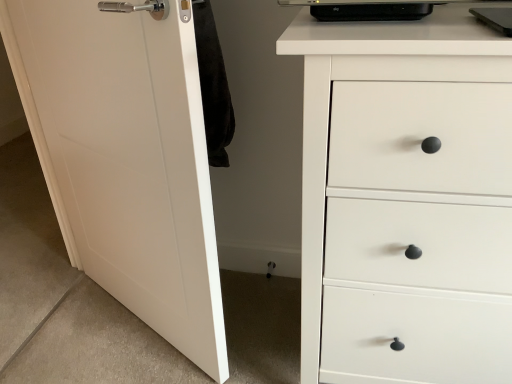
What do you see at coordinates (405, 199) in the screenshot? The width and height of the screenshot is (512, 384). I see `white matte chest of drawers at right` at bounding box center [405, 199].

Locate an element on the screen. The image size is (512, 384). white matte chest of drawers at right is located at coordinates (405, 199).

What do you see at coordinates (126, 157) in the screenshot? The width and height of the screenshot is (512, 384). I see `white matte door at left` at bounding box center [126, 157].

At what (x,y) coordinates should I click in order to perform the action: click on white matte door at left. Please return your answer as a coordinate pair (x, y). This screenshot has height=384, width=512. Looking at the image, I should click on (126, 157).

The height and width of the screenshot is (384, 512). Find the location of `white matte chest of drawers at right`. white matte chest of drawers at right is located at coordinates (405, 199).

Considering the positions of objects white matte chest of drawers at right and white matte door at left in the image provided, who is more to the right, white matte chest of drawers at right or white matte door at left?

Positioned to the right is white matte chest of drawers at right.

Between white matte chest of drawers at right and white matte door at left, which one is positioned behind?

Positioned behind is white matte door at left.

Considering the positions of point (440, 254) and point (185, 43), is point (440, 254) closer or farther from the camera than point (185, 43)?

Clearly, point (440, 254) is more distant from the camera than point (185, 43).

From the image's perspective, does white matte chest of drawers at right appear lower than white matte door at left?

Correct, white matte chest of drawers at right appears lower than white matte door at left in the image.

From a real-world perspective, is white matte chest of drawers at right beneath white matte door at left?

Yes, from a real-world perspective, white matte chest of drawers at right is below white matte door at left.

Does white matte chest of drawers at right have a greater width compared to white matte door at left?

Yes, white matte chest of drawers at right is wider than white matte door at left.

Which of these two, white matte chest of drawers at right or white matte door at left, stands taller?

Standing taller between the two is white matte door at left.

Considering the sizes of objects white matte chest of drawers at right and white matte door at left in the image provided, who is smaller, white matte chest of drawers at right or white matte door at left?

Smaller between the two is white matte door at left.

Is white matte chest of drawers at right spatially inside white matte door at left, or outside of it?

white matte chest of drawers at right is not inside white matte door at left, it's outside.

Is white matte chest of drawers at right positioned far away from white matte door at left?

No, white matte chest of drawers at right is not far away from white matte door at left.

Is white matte chest of drawers at right facing towards white matte door at left?

No.

Measure the distance between white matte chest of drawers at right and white matte door at left.

white matte chest of drawers at right is 20.15 inches from white matte door at left.

Find the location of a particular element. the chest of drawers below the white matte door at left (from the image's perspective) is located at coordinates (405, 199).

Is white matte door at left at the right side of white matte chest of drawers at right?

No, white matte door at left is not to the right of white matte chest of drawers at right.

Is white matte door at left positioned in front of white matte chest of drawers at right?

No, white matte door at left is further to the viewer.

Does point (159, 143) appear closer or farther from the camera than point (395, 290)?

Point (159, 143) appears to be farther away from the viewer than point (395, 290).

From the image's perspective, who appears lower, white matte door at left or white matte chest of drawers at right?

white matte chest of drawers at right is shown below in the image.

From a real-world perspective, is white matte door at left physically located above or below white matte chest of drawers at right?

In terms of real-world spatial position, white matte door at left is above white matte chest of drawers at right.

Looking at their sizes, would you say white matte door at left is wider or thinner than white matte chest of drawers at right?

In the image, white matte door at left appears to be more narrow than white matte chest of drawers at right.

Considering the relative sizes of white matte door at left and white matte chest of drawers at right in the image provided, is white matte door at left shorter than white matte chest of drawers at right?

Incorrect, the height of white matte door at left does not fall short of that of white matte chest of drawers at right.

Considering the relative sizes of white matte door at left and white matte chest of drawers at right in the image provided, is white matte door at left bigger than white matte chest of drawers at right?

No, white matte door at left is not bigger than white matte chest of drawers at right.

Would you say white matte chest of drawers at right is part of white matte door at left's contents?

No, white matte chest of drawers at right is located outside of white matte door at left.

Is white matte door at left in contact with white matte chest of drawers at right?

white matte door at left is not next to white matte chest of drawers at right, and they're not touching.

Is white matte chest of drawers at right at the back of white matte door at left?

No.

Find the location of a particular element. Image resolution: width=512 pixels, height=384 pixels. door above the white matte chest of drawers at right (from a real-world perspective) is located at coordinates (126, 157).

Where is `door behind the white matte chest of drawers at right`? This screenshot has width=512, height=384. door behind the white matte chest of drawers at right is located at coordinates (126, 157).

Find the location of `door on the left of white matte chest of drawers at right`. door on the left of white matte chest of drawers at right is located at coordinates (126, 157).